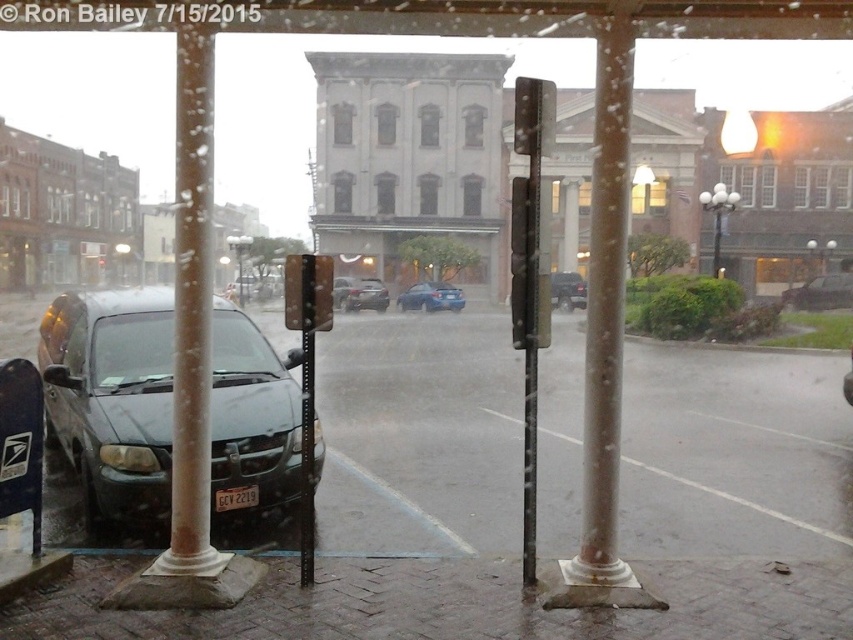
Can you confirm if matte black suv at center is positioned to the right of metallic rectangular traffic light at left?

Indeed, matte black suv at center is positioned on the right side of metallic rectangular traffic light at left.

Describe the element at coordinates (567, 291) in the screenshot. I see `matte black suv at center` at that location.

Find the location of `matte black suv at center`. matte black suv at center is located at coordinates (567, 291).

What are the coordinates of `matte black suv at center` in the screenshot? It's located at (567, 291).

Who is positioned more to the right, white marble pole at left or matte black suv at center?

matte black suv at center is more to the right.

Who is higher up, white marble pole at left or matte black suv at center?

matte black suv at center is above.

What do you see at coordinates (190, 316) in the screenshot? The width and height of the screenshot is (853, 640). I see `white marble pole at left` at bounding box center [190, 316].

Identify the location of white marble pole at left. This screenshot has height=640, width=853. (190, 316).

Can you confirm if white marble pole at left is positioned to the right of metallic silver streetlight at upper right?

Incorrect, white marble pole at left is not on the right side of metallic silver streetlight at upper right.

Is white marble pole at left closer to camera compared to metallic silver streetlight at upper right?

Yes, white marble pole at left is closer to the viewer.

The width and height of the screenshot is (853, 640). What are the coordinates of `white marble pole at left` in the screenshot? It's located at (190, 316).